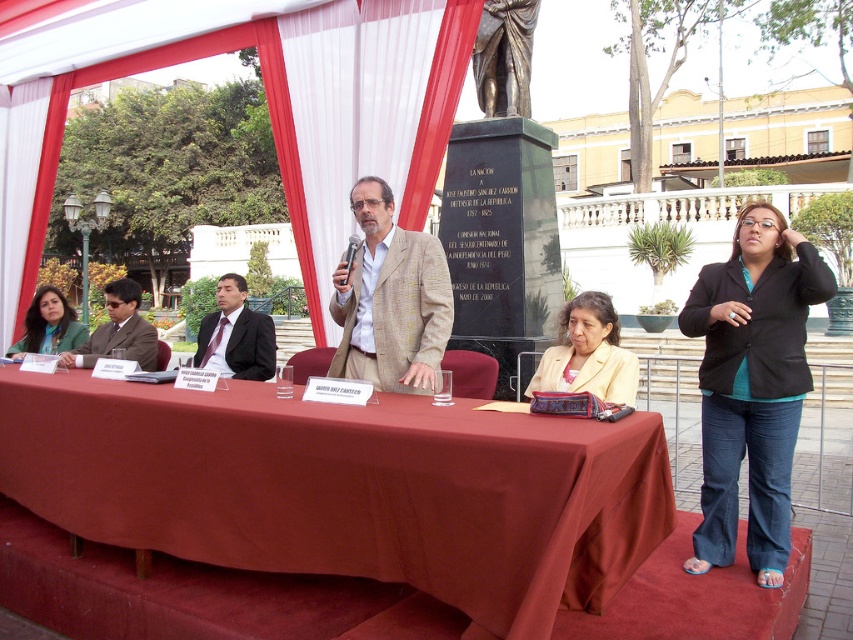
Between light yellow fabric jacket at center and matte brown suit at left, which one is positioned higher?

matte brown suit at left

Does light yellow fabric jacket at center appear over matte brown suit at left?

Incorrect, light yellow fabric jacket at center is not positioned above matte brown suit at left.

Locate an element on the screen. The height and width of the screenshot is (640, 853). light yellow fabric jacket at center is located at coordinates (589, 353).

I want to click on light yellow fabric jacket at center, so click(x=589, y=353).

Is maroon fabric table at center wider than matte brown suit at left?

Yes, maroon fabric table at center is wider than matte brown suit at left.

Is maroon fabric table at center shorter than matte brown suit at left?

In fact, maroon fabric table at center may be taller than matte brown suit at left.

Find the location of `maroon fabric table at center`. maroon fabric table at center is located at coordinates (347, 488).

Where is `black matte blazer at lower right`? black matte blazer at lower right is located at coordinates (752, 385).

Does black matte blazer at lower right have a lesser width compared to matte brown suit at left?

Yes.

Does point (756, 209) lie in front of point (148, 346)?

Yes, it is.

The width and height of the screenshot is (853, 640). Find the location of `black matte blazer at lower right`. black matte blazer at lower right is located at coordinates (752, 385).